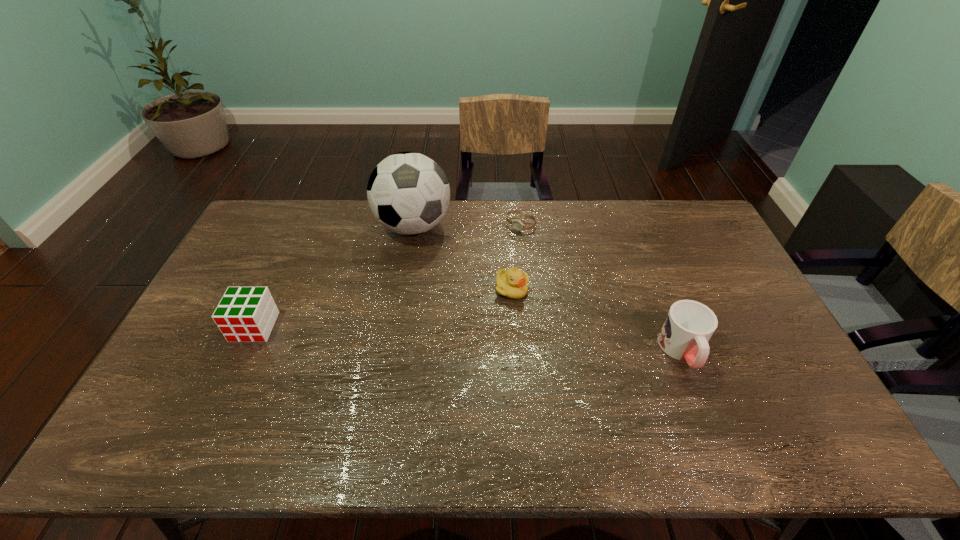
The height and width of the screenshot is (540, 960). I want to click on object that is at the left edge, so click(x=247, y=314).

Find the location of a particular element. vacant point at the far edge is located at coordinates (393, 237).

In the image, there is a desktop. Identify the location of vacant region at the right edge. (723, 275).

What are the coordinates of `vacant region at the near left corner of the desktop` in the screenshot? It's located at (177, 397).

I want to click on free space at the far right corner of the desktop, so click(662, 217).

The image size is (960, 540). In order to click on free spot between the rightmost object and the watch in this screenshot , I will do `click(602, 288)`.

Locate an element on the screen. The width and height of the screenshot is (960, 540). vacant space in between the shortest object and the third farthest object is located at coordinates (516, 256).

You are a GUI agent. You are given a task and a screenshot of the screen. Output one action in this format:
    pyautogui.click(x=<x>, y=<y>)
    Task: Click on the vacant space in between the shortest object and the tallest object
    The width and height of the screenshot is (960, 540).
    Given the screenshot: What is the action you would take?
    pyautogui.click(x=468, y=225)

Identify the location of empty space that is in between the rightmost object and the soccer ball. (548, 288).

I want to click on unoccupied position between the second object from left to right and the mug, so coord(548,288).